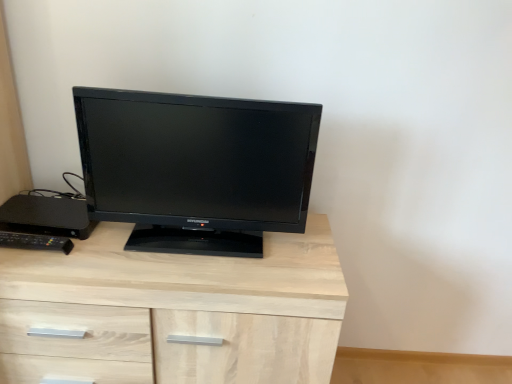
Question: Is light wood chest of drawers at center positioned behind black plastic desktop at left, the second desktop in the front-to-back sequence?

Choices:
 (A) yes
 (B) no

Answer: (B)

Question: Can you confirm if light wood chest of drawers at center is shorter than black plastic desktop at left, the second desktop in the front-to-back sequence?

Choices:
 (A) yes
 (B) no

Answer: (B)

Question: From the image's perspective, would you say light wood chest of drawers at center is shown under black plastic desktop at left, the second desktop in the front-to-back sequence?

Choices:
 (A) yes
 (B) no

Answer: (A)

Question: Considering the relative sizes of light wood chest of drawers at center and black plastic desktop at left, the second desktop in the front-to-back sequence, in the image provided, is light wood chest of drawers at center smaller than black plastic desktop at left, the second desktop in the front-to-back sequence,?

Choices:
 (A) yes
 (B) no

Answer: (B)

Question: Could black plastic desktop at left, acting as the first desktop starting from the back, be considered to be inside light wood chest of drawers at center?

Choices:
 (A) no
 (B) yes

Answer: (B)

Question: In terms of width, does black plastic desktop at left, acting as the first desktop starting from the back, look wider or thinner when compared to black glossy monitor at center?

Choices:
 (A) wide
 (B) thin

Answer: (B)

Question: From the image's perspective, is black plastic desktop at left, acting as the first desktop starting from the back, located above or below black glossy monitor at center?

Choices:
 (A) above
 (B) below

Answer: (B)

Question: Is black plastic desktop at left, the second desktop in the front-to-back sequence, inside or outside of black glossy monitor at center?

Choices:
 (A) outside
 (B) inside

Answer: (A)

Question: Considering their positions, is black plastic desktop at left, acting as the first desktop starting from the back, located in front of or behind black glossy monitor at center?

Choices:
 (A) behind
 (B) front

Answer: (A)

Question: From a real-world perspective, is light wood chest of drawers at center positioned above or below black glossy monitor at center?

Choices:
 (A) above
 (B) below

Answer: (B)

Question: Do you think light wood chest of drawers at center is within black glossy monitor at center, or outside of it?

Choices:
 (A) inside
 (B) outside

Answer: (B)

Question: Would you say light wood chest of drawers at center is to the left or to the right of black glossy monitor at center in the picture?

Choices:
 (A) left
 (B) right

Answer: (A)

Question: From their relative heights in the image, would you say light wood chest of drawers at center is taller or shorter than black glossy monitor at center?

Choices:
 (A) tall
 (B) short

Answer: (A)

Question: Considering their positions, is black plastic desktop at left, the second desktop in the front-to-back sequence, located in front of or behind black plastic remote control at left, which is the first desktop from front to back?

Choices:
 (A) front
 (B) behind

Answer: (B)

Question: From a real-world perspective, relative to black plastic remote control at left, which is the first desktop from front to back, is black plastic desktop at left, acting as the first desktop starting from the back, vertically above or below?

Choices:
 (A) below
 (B) above

Answer: (A)